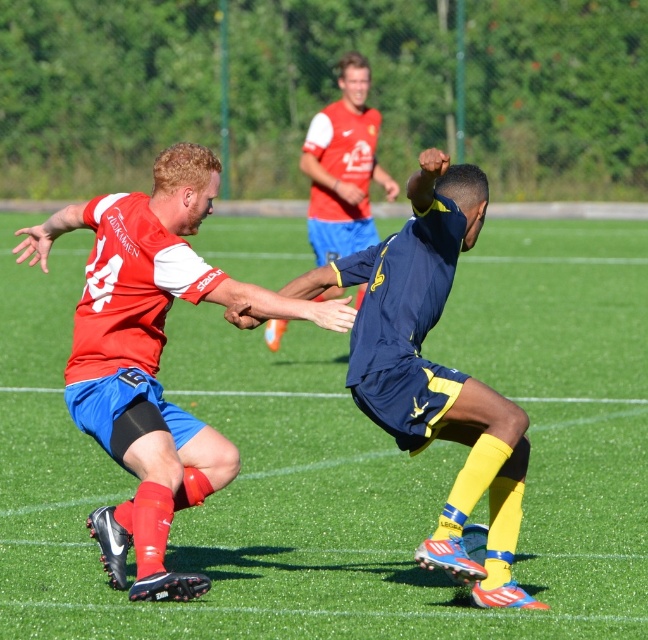
Between matte red jersey at center and blue matte shorts at center, which one has less height?

blue matte shorts at center

Is matte red jersey at center to the left of blue matte shorts at center from the viewer's perspective?

Correct, you'll find matte red jersey at center to the left of blue matte shorts at center.

Measure the distance between matte red jersey at center and camera.

The distance of matte red jersey at center from camera is 6.01 meters.

Image resolution: width=648 pixels, height=640 pixels. I want to click on matte red jersey at center, so 152,355.

Between green grass football field at center and blue matte shorts at center, which one has less height?

blue matte shorts at center is shorter.

Is point (148, 605) positioned after point (373, 332)?

No, (148, 605) is in front of (373, 332).

Does point (625, 404) come in front of point (321, 268)?

No, it is behind (321, 268).

Locate an element on the screen. This screenshot has height=640, width=648. green grass football field at center is located at coordinates (345, 458).

Between green grass football field at center and matte red jersey at center, which one is positioned lower?

Answer: matte red jersey at center is below.

Locate an element on the screen. The height and width of the screenshot is (640, 648). green grass football field at center is located at coordinates tap(345, 458).